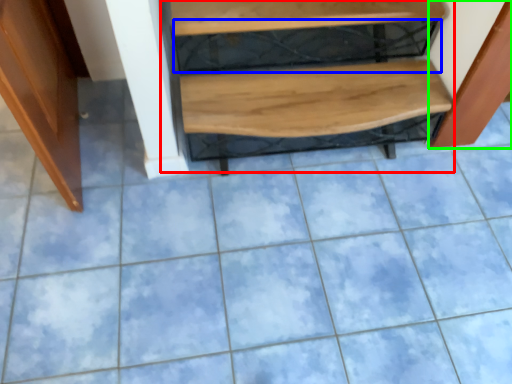
Question: Which object is the closest to the stairwell (highlighted by a red box)? Choose among these: shelf (highlighted by a blue box) or cabinetry (highlighted by a green box).

Choices:
 (A) shelf
 (B) cabinetry

Answer: (A)